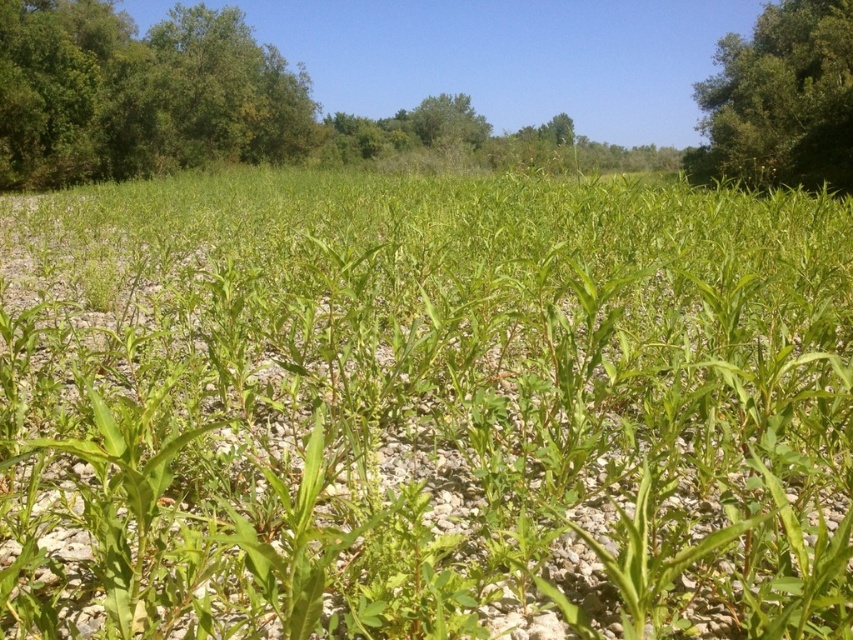
Question: In this image, where is green leafy corn at center located relative to green leafy tree at upper right?

Choices:
 (A) above
 (B) below

Answer: (B)

Question: Which of these objects is positioned farthest from the green leafy tree at upper left?

Choices:
 (A) green leafy tree at upper right
 (B) green leafy corn at center

Answer: (A)

Question: Which object is closer to the camera taking this photo?

Choices:
 (A) green leafy tree at upper right
 (B) green leafy corn at center
 (C) green leafy tree at upper left

Answer: (B)

Question: Is green leafy corn at center closer to camera compared to green leafy tree at upper left?

Choices:
 (A) no
 (B) yes

Answer: (B)

Question: Does green leafy tree at upper left appear on the right side of green leafy tree at upper right?

Choices:
 (A) yes
 (B) no

Answer: (B)

Question: Which of the following is the farthest from the observer?

Choices:
 (A) green leafy tree at upper right
 (B) green leafy corn at center

Answer: (A)